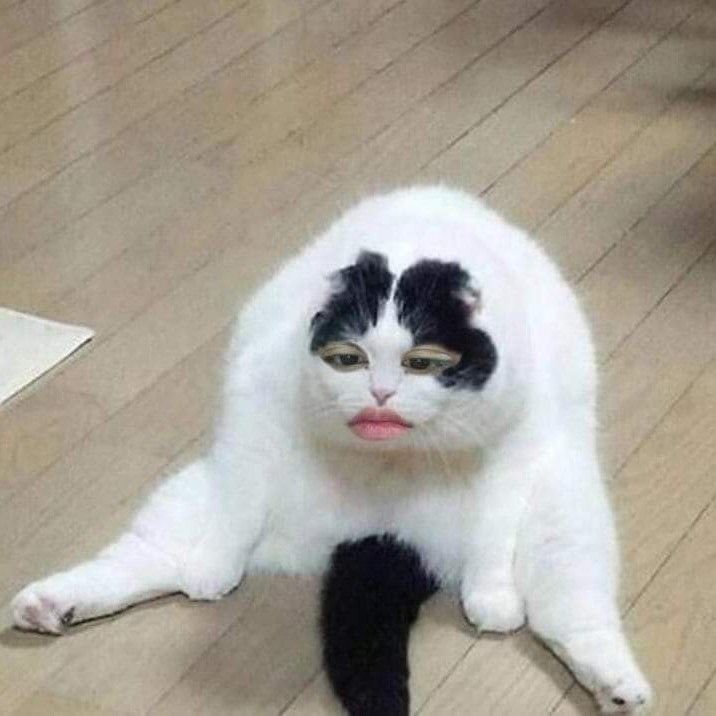
Locate an element on the screen. This screenshot has height=716, width=716. white fur is located at coordinates (543, 319), (281, 299).